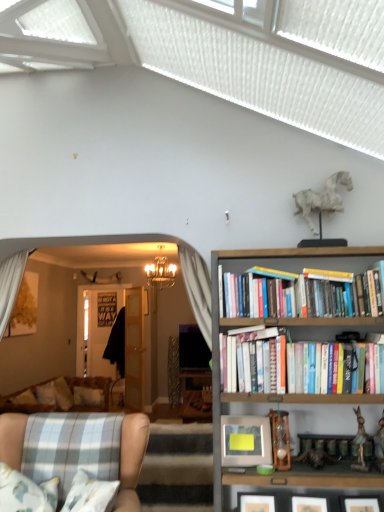
Question: Is wooden bookshelf at upper right inside or outside of crystal chandelier at center?

Choices:
 (A) inside
 (B) outside

Answer: (B)

Question: From a real-world perspective, is wooden bookshelf at upper right positioned above or below crystal chandelier at center?

Choices:
 (A) below
 (B) above

Answer: (A)

Question: Which object is positioned farthest from the metallic silver picture frame at right?

Choices:
 (A) plaid fabric armchair at lower left
 (B) wooden bookshelf at upper right
 (C) crystal chandelier at center

Answer: (C)

Question: Based on their relative distances, which object is farther from the plaid fabric armchair at lower left?

Choices:
 (A) crystal chandelier at center
 (B) wooden bookshelf at upper right
 (C) metallic silver picture frame at right

Answer: (A)